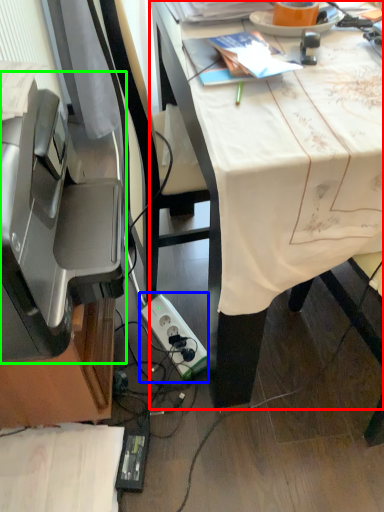
Question: Which object is the farthest from desk (highlighted by a red box)? Choose among these: power plugs and sockets (highlighted by a blue box) or printer (highlighted by a green box).

Choices:
 (A) power plugs and sockets
 (B) printer

Answer: (A)